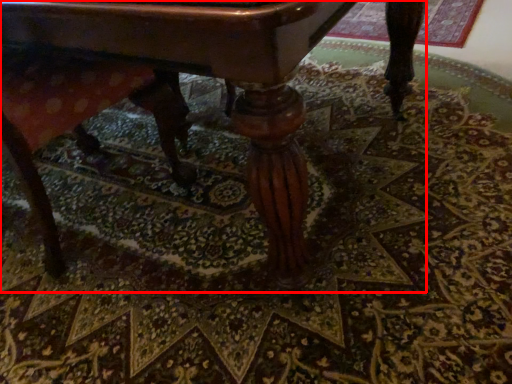
Question: From the image's perspective, considering the relative positions of table (annotated by the red box) and swivel chair in the image provided, where is table (annotated by the red box) located with respect to the staircase?

Choices:
 (A) below
 (B) above

Answer: (B)